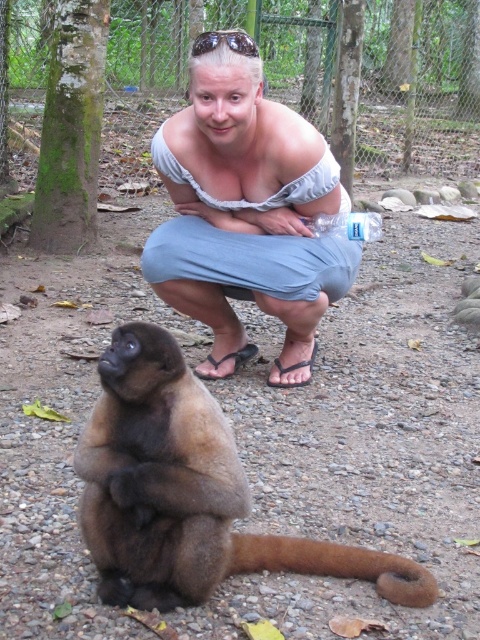
Is light blue denim pants at center to the right of transparent plastic goggles at upper center from the viewer's perspective?

Yes, light blue denim pants at center is to the right of transparent plastic goggles at upper center.

You are a GUI agent. You are given a task and a screenshot of the screen. Output one action in this format:
    pyautogui.click(x=<x>, y=<y>)
    Task: Click on the light blue denim pants at center
    
    Given the screenshot: What is the action you would take?
    pyautogui.click(x=247, y=216)

Does brown furry monkey at lower left appear over transparent plastic goggles at upper center?

Actually, brown furry monkey at lower left is below transparent plastic goggles at upper center.

Who is taller, brown furry monkey at lower left or transparent plastic goggles at upper center?

brown furry monkey at lower left

Who is more forward, [117,378] or [238,32]?

Positioned in front is point [117,378].

At what (x,y) coordinates should I click in order to perform the action: click on brown furry monkey at lower left. Please return your answer as a coordinate pair (x, y). Looking at the image, I should click on (188, 492).

Is brown furry monkey at lower left smaller than brown furry tail at lower center?

No, brown furry monkey at lower left is not smaller than brown furry tail at lower center.

Locate an element on the screen. The height and width of the screenshot is (640, 480). brown furry monkey at lower left is located at coordinates (188, 492).

Where is `brown furry monkey at lower left`? Image resolution: width=480 pixels, height=640 pixels. brown furry monkey at lower left is located at coordinates (188, 492).